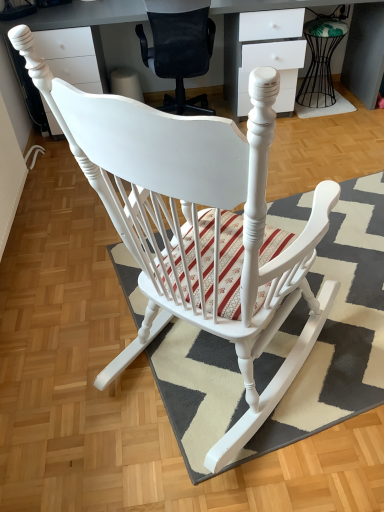
Question: Does white glossy desk at upper center have a greater height compared to white woven mat at lower right, the first doormat positioned from the top?

Choices:
 (A) no
 (B) yes

Answer: (B)

Question: From the image's perspective, is white glossy desk at upper center located above white woven mat at lower right, arranged as the second doormat when viewed from the front?

Choices:
 (A) no
 (B) yes

Answer: (B)

Question: Is white glossy desk at upper center bigger than white woven mat at lower right, the first doormat positioned from the top?

Choices:
 (A) no
 (B) yes

Answer: (B)

Question: Considering the relative positions of white glossy desk at upper center and white woven mat at lower right, positioned as the 2th doormat in bottom-to-top order, in the image provided, is white glossy desk at upper center behind white woven mat at lower right, positioned as the 2th doormat in bottom-to-top order,?

Choices:
 (A) no
 (B) yes

Answer: (A)

Question: Is white glossy desk at upper center completely or partially outside of white woven mat at lower right, marked as the first doormat in a back-to-front arrangement?

Choices:
 (A) yes
 (B) no

Answer: (A)

Question: From the image's perspective, does white glossy desk at upper center appear lower than white woven mat at lower right, positioned as the 2th doormat in bottom-to-top order?

Choices:
 (A) yes
 (B) no

Answer: (B)

Question: Does white woven mat at lower right, the first doormat positioned from the top, lie behind textured gray rug at center, marked as the 2th doormat in a back-to-front arrangement?

Choices:
 (A) yes
 (B) no

Answer: (A)

Question: Does white woven mat at lower right, positioned as the 2th doormat in bottom-to-top order, appear on the left side of textured gray rug at center, which appears as the 1th doormat when viewed from the front?

Choices:
 (A) no
 (B) yes

Answer: (A)

Question: Is white woven mat at lower right, positioned as the 2th doormat in bottom-to-top order, taller than textured gray rug at center, placed as the 1th doormat when sorted from bottom to top?

Choices:
 (A) no
 (B) yes

Answer: (B)

Question: Can you confirm if white woven mat at lower right, the first doormat positioned from the top, is positioned to the right of textured gray rug at center, which appears as the 1th doormat when viewed from the front?

Choices:
 (A) yes
 (B) no

Answer: (A)

Question: Is white woven mat at lower right, the first doormat positioned from the top, wider than textured gray rug at center, marked as the 2th doormat in a back-to-front arrangement?

Choices:
 (A) no
 (B) yes

Answer: (A)

Question: Would you say white woven mat at lower right, arranged as the second doormat when viewed from the front, is a long distance from textured gray rug at center, marked as the 2th doormat in a back-to-front arrangement?

Choices:
 (A) yes
 (B) no

Answer: (A)

Question: Is white glossy desk at upper center surrounded by white woven mat at lower right, marked as the first doormat in a back-to-front arrangement?

Choices:
 (A) no
 (B) yes

Answer: (A)